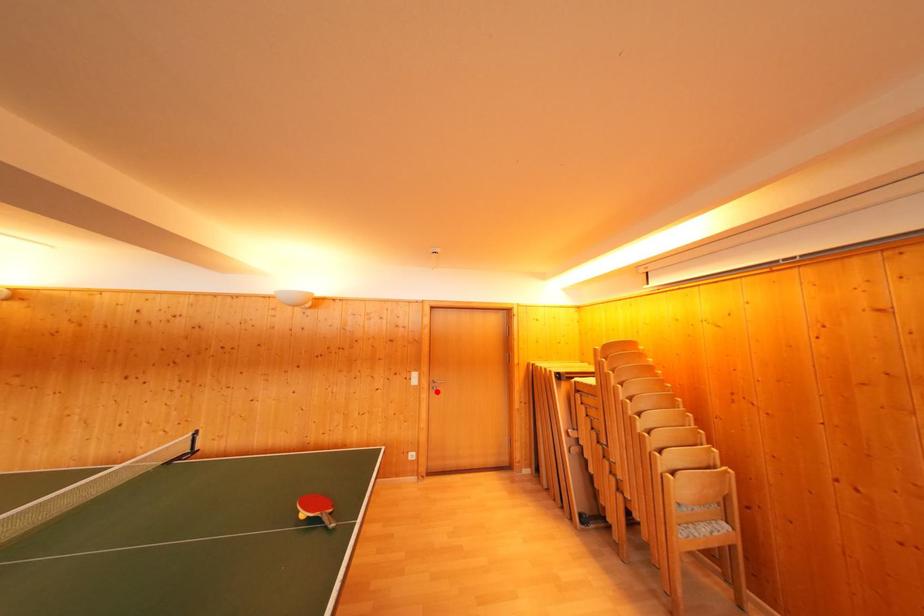
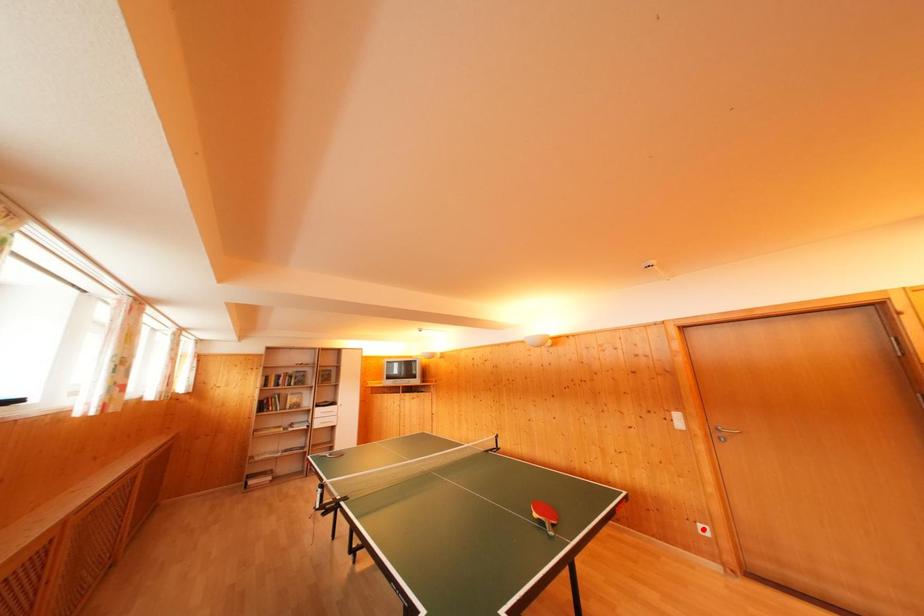
I am providing you with two images of the same scene from different viewpoints. A red point is marked on the first image and another point is marked on the second image. Is the red point in image1 aligned with the point shown in image2?

No